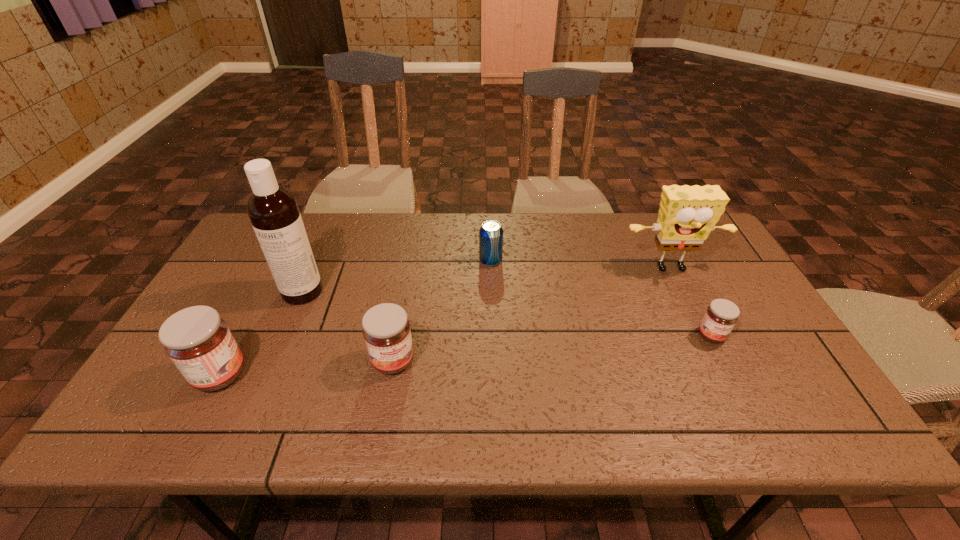
Identify the location of vacant space at the near edge of the desktop. (507, 386).

Find the location of a particular element. free space at the left edge of the desktop is located at coordinates (252, 295).

In the image, there is a desktop. Identify the location of vacant area at the right edge. The height and width of the screenshot is (540, 960). (689, 277).

The width and height of the screenshot is (960, 540). What are the coordinates of `free location at the far left corner of the desktop` in the screenshot? It's located at [252, 228].

This screenshot has height=540, width=960. I want to click on vacant space at the near left corner of the desktop, so click(x=163, y=375).

Where is `vacant area that lies between the beer can and the second tallest jam`? The image size is (960, 540). vacant area that lies between the beer can and the second tallest jam is located at coordinates (442, 311).

You are a GUI agent. You are given a task and a screenshot of the screen. Output one action in this format:
    pyautogui.click(x=<x>, y=<y>)
    Task: Click on the free space between the shortest jam and the leftmost jam
    This screenshot has width=960, height=540.
    Given the screenshot: What is the action you would take?
    pyautogui.click(x=466, y=355)

Where is `free spot between the leftmost jam and the dishwasher detergent`? The image size is (960, 540). free spot between the leftmost jam and the dishwasher detergent is located at coordinates (261, 333).

The height and width of the screenshot is (540, 960). I want to click on vacant point located between the beer can and the rightmost jam, so click(601, 298).

Where is `free space between the dishwasher detergent and the third object from left to right`? The height and width of the screenshot is (540, 960). free space between the dishwasher detergent and the third object from left to right is located at coordinates (348, 326).